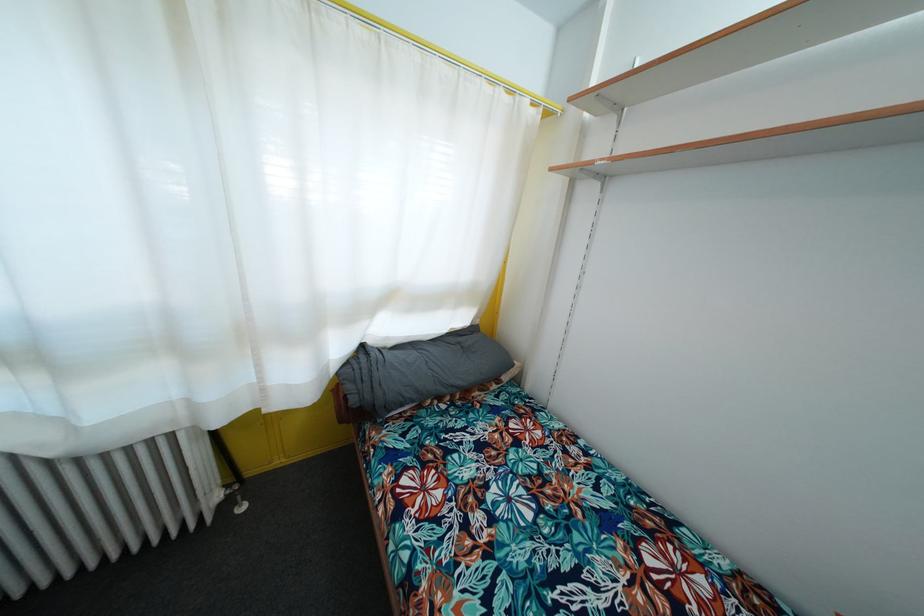
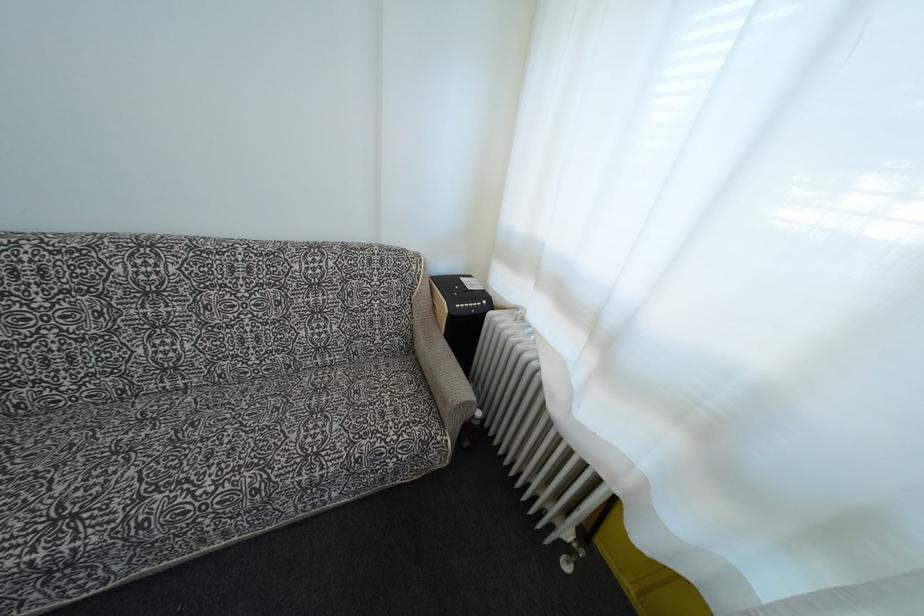
The first image is from the beginning of the video and the second image is from the end. How did the camera likely rotate when shooting the video?

The camera rotated toward left-down.